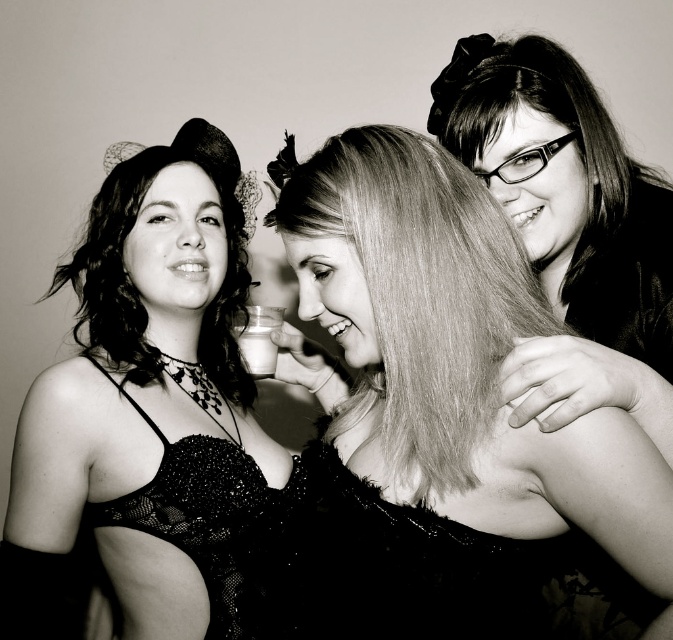
You are a photographer trying to capture a closeup of the translucent glass at center without including the matte black lace dress at left in the frame. Based on their positions, is this possible?

The matte black lace dress at left is positioned on the left side of the translucent glass at center, so if the photographer moves to the right side of the glass, they can frame the shot to exclude the dress.

You are a photographer analyzing this black and white photo. You notice the black sequined dress at center and the translucent glass at center. Which object takes up more space in the image?

The black sequined dress at center is larger in size than the translucent glass at center, so it takes up more space in the image.

You are a photographer adjusting your camera settings. You want to focus on the matte black lace dress at left while keeping the other subjects in the frame. What is the minimum distance you should set your camera focus to ensure the dress is sharp?

The minimum distance you should set your camera focus is 3.54 feet to ensure the matte black lace dress at left is sharp since it is the closest object to the camera at that distance.